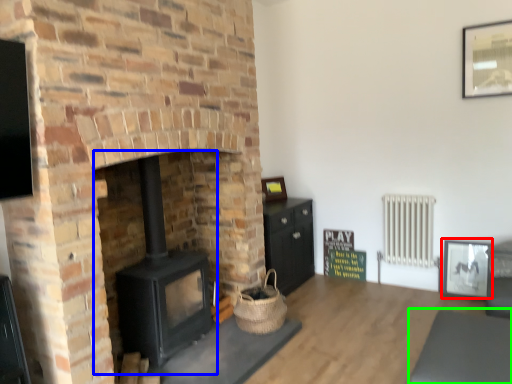
Question: Which is nearer to the picture frame (highlighted by a red box)? wood burning stove (highlighted by a blue box) or gray (highlighted by a green box).

Choices:
 (A) wood burning stove
 (B) gray

Answer: (B)